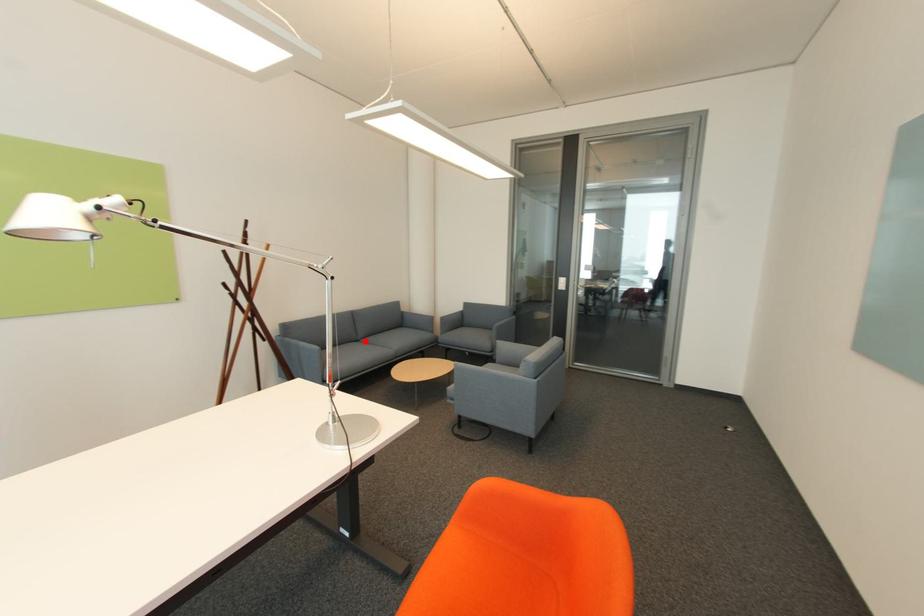
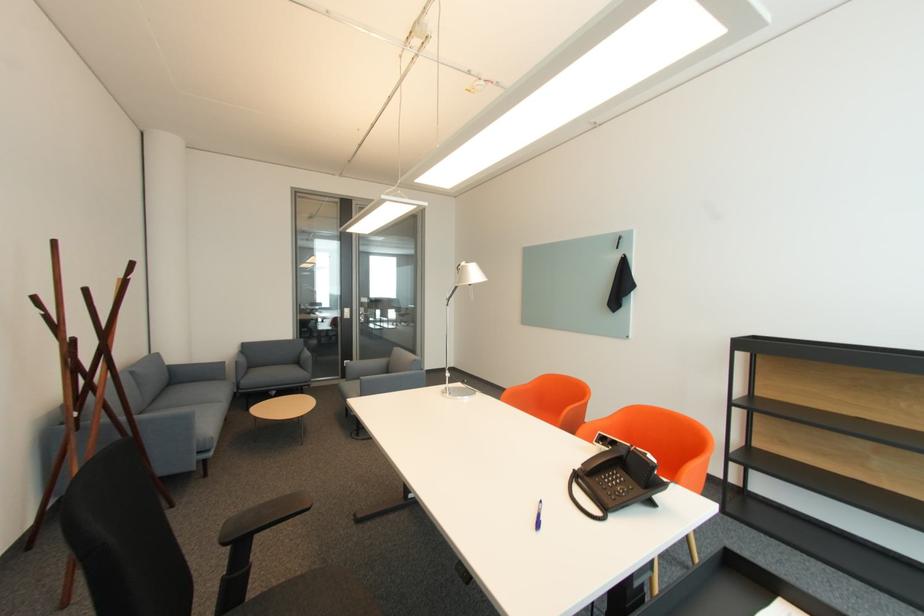
Question: A red point is marked in image1. In image2, is the corresponding 3D point closer to the camera or farther? Reply with the corresponding letter.

Choices:
 (A) The corresponding 3D point is closer.
 (B) The corresponding 3D point is farther.

Answer: (B)